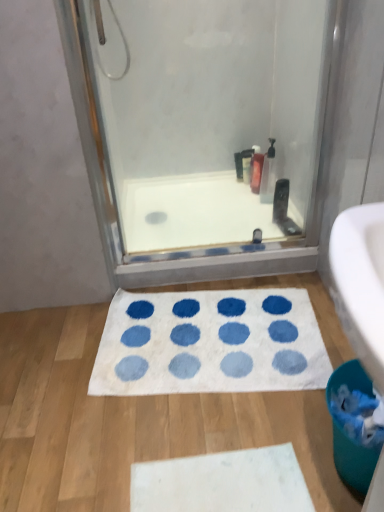
Question: Does clear plastic pump bottle at upper right, acting as the first cleaning product starting from the front, have a smaller size compared to white soft bath mat at center?

Choices:
 (A) no
 (B) yes

Answer: (B)

Question: From the image's perspective, is clear plastic pump bottle at upper right, acting as the first cleaning product starting from the front, on white soft bath mat at center?

Choices:
 (A) yes
 (B) no

Answer: (A)

Question: Is clear plastic pump bottle at upper right, which is counted as the second cleaning product, starting from the back, touching white soft bath mat at center?

Choices:
 (A) yes
 (B) no

Answer: (B)

Question: Considering the relative sizes of clear plastic pump bottle at upper right, which is counted as the second cleaning product, starting from the back, and white soft bath mat at center in the image provided, is clear plastic pump bottle at upper right, which is counted as the second cleaning product, starting from the back, bigger than white soft bath mat at center?

Choices:
 (A) no
 (B) yes

Answer: (A)

Question: Considering the relative sizes of clear plastic pump bottle at upper right, acting as the first cleaning product starting from the front, and white soft bath mat at center in the image provided, is clear plastic pump bottle at upper right, acting as the first cleaning product starting from the front, taller than white soft bath mat at center?

Choices:
 (A) no
 (B) yes

Answer: (B)

Question: Can you confirm if clear plastic pump bottle at upper right, which is counted as the second cleaning product, starting from the back, is thinner than white soft bath mat at center?

Choices:
 (A) yes
 (B) no

Answer: (A)

Question: Is translucent plastic bottle at upper center, the first cleaning product viewed from the back, turned away from matte black bottle at upper center?

Choices:
 (A) yes
 (B) no

Answer: (B)

Question: Is translucent plastic bottle at upper center, the first cleaning product viewed from the back, positioned in front of matte black bottle at upper center?

Choices:
 (A) yes
 (B) no

Answer: (A)

Question: Can we say translucent plastic bottle at upper center, which ranks as the second cleaning product in front-to-back order, lies outside matte black bottle at upper center?

Choices:
 (A) no
 (B) yes

Answer: (B)

Question: Does translucent plastic bottle at upper center, which ranks as the second cleaning product in front-to-back order, appear on the left side of matte black bottle at upper center?

Choices:
 (A) yes
 (B) no

Answer: (B)

Question: Can you confirm if translucent plastic bottle at upper center, the first cleaning product viewed from the back, is smaller than matte black bottle at upper center?

Choices:
 (A) yes
 (B) no

Answer: (B)

Question: Is transparent glass shower door at upper center outside teal plastic toilet bowl at lower right?

Choices:
 (A) no
 (B) yes

Answer: (B)